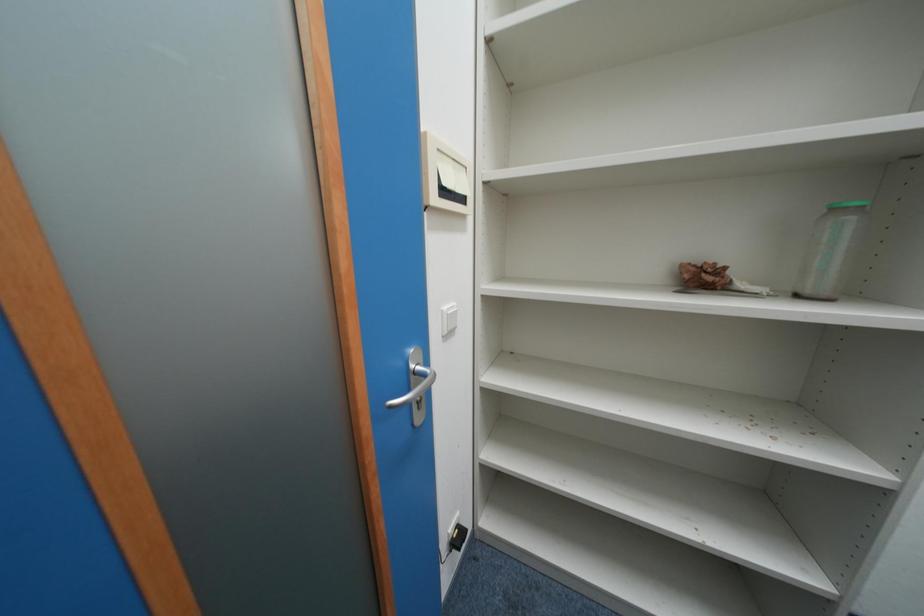
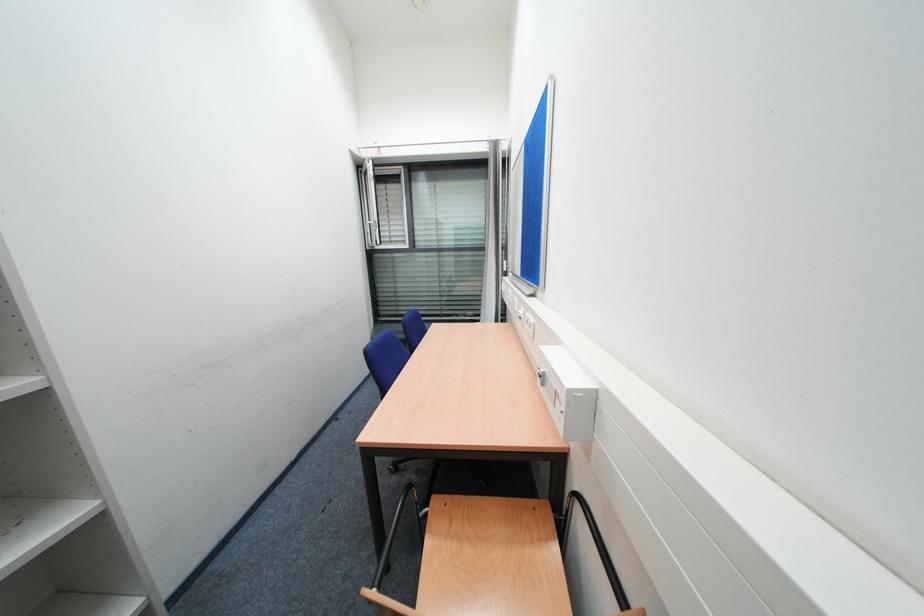
The first image is from the beginning of the video and the second image is from the end. How did the camera likely rotate when shooting the video?

The camera rotated toward right-down.